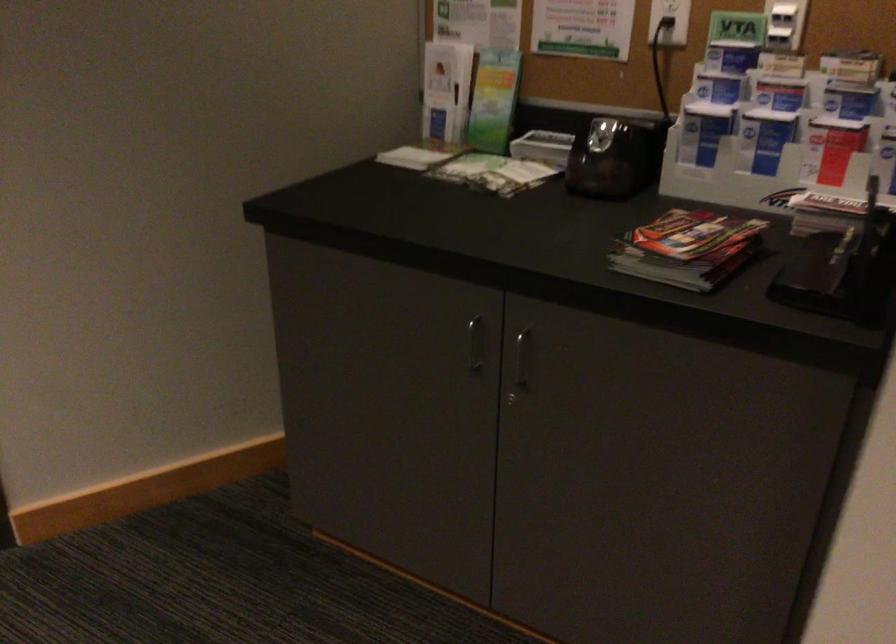
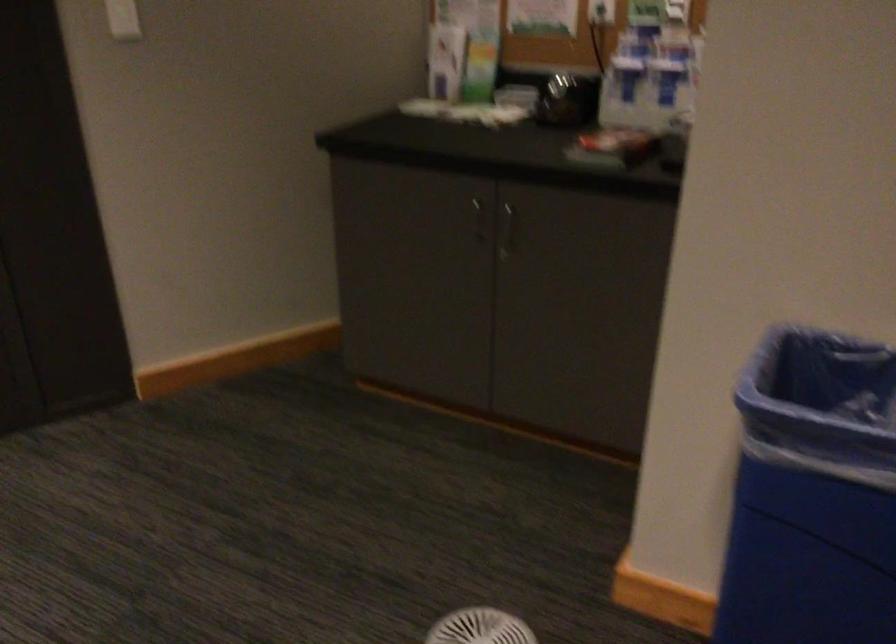
Question: The first image is from the beginning of the video and the second image is from the end. How did the camera likely rotate when shooting the video?

Choices:
 (A) Left
 (B) Right
 (C) Up
 (D) Down

Answer: (B)